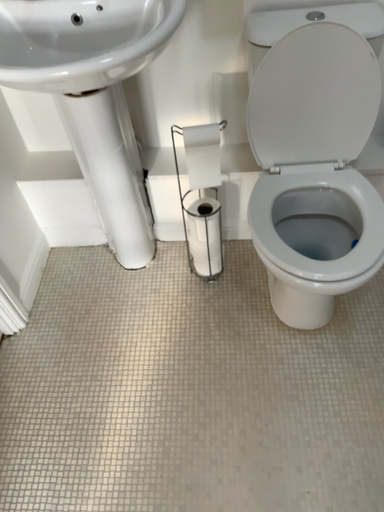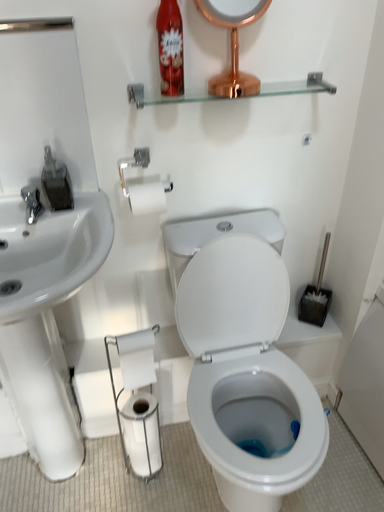
Question: Which way did the camera rotate in the video?

Choices:
 (A) rotated upward
 (B) rotated downward

Answer: (A)